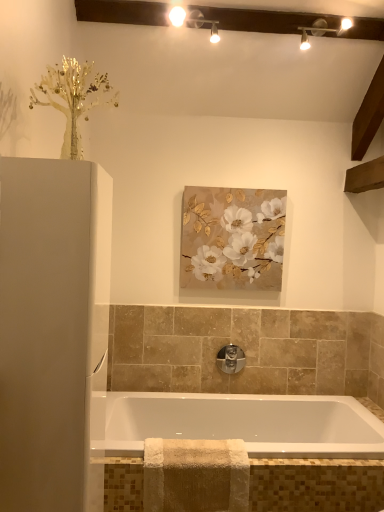
Measure the distance between point (x=279, y=258) and camera.

Point (x=279, y=258) and camera are 9.70 feet apart from each other.

Locate an element on the screen. This screenshot has width=384, height=512. white glossy cabinet at left is located at coordinates (45, 333).

The height and width of the screenshot is (512, 384). I want to click on beige textured towel at lower center, so click(x=195, y=475).

Describe the element at coordinates (177, 16) in the screenshot. I see `matte white track lights at upper center` at that location.

Locate an element on the screen. The image size is (384, 512). white glossy bathtub at center is located at coordinates coord(237,423).

The height and width of the screenshot is (512, 384). I want to click on floral arrangement lying behind the matte white track lights at upper center, so click(x=232, y=238).

Can matte gold and white floral painting at center be found inside matte white track lights at upper center?

No.

How many degrees apart are the facing directions of matte white track lights at upper center and matte gold and white floral painting at center?

The facing directions of matte white track lights at upper center and matte gold and white floral painting at center are 0.0879 degrees apart.

Consider the image. Who is taller, matte white track lights at upper center or matte gold and white floral painting at center?

Standing taller between the two is matte gold and white floral painting at center.

Do you think beige textured towel at lower center is within satin nickel faucet at center, or outside of it?

beige textured towel at lower center lies outside satin nickel faucet at center.

Is beige textured towel at lower center oriented towards satin nickel faucet at center?

No, beige textured towel at lower center is not turned towards satin nickel faucet at center.

Consider the image. Between beige textured towel at lower center and satin nickel faucet at center, which one has larger size?

With larger size is beige textured towel at lower center.

Considering the sizes of matte gold and white floral painting at center and white glossy bathtub at center in the image, is matte gold and white floral painting at center wider or thinner than white glossy bathtub at center?

Clearly, matte gold and white floral painting at center has less width compared to white glossy bathtub at center.

Does matte gold and white floral painting at center touch white glossy bathtub at center?

No, matte gold and white floral painting at center is not beside white glossy bathtub at center.

Is matte gold and white floral painting at center spatially inside white glossy bathtub at center, or outside of it?

matte gold and white floral painting at center is not inside white glossy bathtub at center, it's outside.

Could you tell me if matte gold and white floral painting at center is turned towards white glossy bathtub at center?

No, matte gold and white floral painting at center is not facing towards white glossy bathtub at center.

Which object is further away from the camera, matte white track lights at upper center or satin nickel faucet at center?

satin nickel faucet at center is behind.

Is matte white track lights at upper center far from satin nickel faucet at center?

That's right, there is a large distance between matte white track lights at upper center and satin nickel faucet at center.

Find the location of a particular element. light fixture on the left of the satin nickel faucet at center is located at coordinates (177, 16).

Considering the sizes of objects matte gold and white floral painting at center and matte white track lights at upper center in the image provided, who is taller, matte gold and white floral painting at center or matte white track lights at upper center?

matte gold and white floral painting at center.

Can you tell me how much matte gold and white floral painting at center and matte white track lights at upper center differ in facing direction?

0.0879 degrees.

Can you confirm if matte gold and white floral painting at center is smaller than matte white track lights at upper center?

Yes.

From a real-world perspective, between matte gold and white floral painting at center and matte white track lights at upper center, who is vertically higher?

From a 3D spatial view, matte white track lights at upper center is above.

Does point (231, 346) lie behind point (277, 454)?

Yes.

Between satin nickel faucet at center and white glossy bathtub at center, which one appears on the right side from the viewer's perspective?

From the viewer's perspective, white glossy bathtub at center appears more on the right side.

Looking at this image, is there a large distance between satin nickel faucet at center and white glossy bathtub at center?

No, satin nickel faucet at center is in close proximity to white glossy bathtub at center.

From the image's perspective, which object appears higher, satin nickel faucet at center or white glossy bathtub at center?

satin nickel faucet at center.

The image size is (384, 512). I want to click on bathtub above the beige textured towel at lower center (from the image's perspective), so click(237, 423).

From a real-world perspective, between white glossy bathtub at center and beige textured towel at lower center, who is vertically lower?

beige textured towel at lower center, from a real-world perspective.

Between white glossy bathtub at center and beige textured towel at lower center, which one has less height?

white glossy bathtub at center is shorter.

Identify the location of floral arrangement lying below the matte white track lights at upper center (from the image's perspective). (232, 238).

In order to click on material below the satin nickel faucet at center (from a real-world perspective) in this screenshot , I will do `click(195, 475)`.

From the image, which object appears to be nearer to white glossy bathtub at center, white glossy cabinet at left or beige textured towel at lower center?

beige textured towel at lower center is positioned closer to the anchor white glossy bathtub at center.

Estimate the real-world distances between objects in this image. Which object is further from beige textured towel at lower center, matte gold and white floral painting at center or satin nickel faucet at center?

Based on the image, matte gold and white floral painting at center appears to be further to beige textured towel at lower center.

Looking at the image, which one is located further to white glossy bathtub at center, matte gold and white floral painting at center or satin nickel faucet at center?

matte gold and white floral painting at center lies further to white glossy bathtub at center than the other object.

Which object lies further to the anchor point white glossy cabinet at left, white glossy bathtub at center or satin nickel faucet at center?

satin nickel faucet at center is further to white glossy cabinet at left.

Estimate the real-world distances between objects in this image. Which object is further from satin nickel faucet at center, white glossy bathtub at center or matte gold and white floral painting at center?

matte gold and white floral painting at center lies further to satin nickel faucet at center than the other object.

When comparing their distances from satin nickel faucet at center, does matte gold and white floral painting at center or beige textured towel at lower center seem further?

beige textured towel at lower center is positioned further to the anchor satin nickel faucet at center.

Which object lies further to the anchor point matte white track lights at upper center, white glossy cabinet at left or beige textured towel at lower center?

Based on the image, beige textured towel at lower center appears to be further to matte white track lights at upper center.

Which object lies further to the anchor point matte gold and white floral painting at center, matte white track lights at upper center or satin nickel faucet at center?

The object further to matte gold and white floral painting at center is matte white track lights at upper center.

The height and width of the screenshot is (512, 384). Find the location of `screen door that lies between matte white track lights at upper center and satin nickel faucet at center from top to bottom`. screen door that lies between matte white track lights at upper center and satin nickel faucet at center from top to bottom is located at coordinates (45, 333).

The width and height of the screenshot is (384, 512). What are the coordinates of `material between white glossy cabinet at left and white glossy bathtub at center` in the screenshot? It's located at (x=195, y=475).

What are the coordinates of `material between white glossy cabinet at left and matte gold and white floral painting at center from front to back` in the screenshot? It's located at (195, 475).

Find the location of a particular element. The width and height of the screenshot is (384, 512). floral arrangement that lies between matte white track lights at upper center and satin nickel faucet at center from top to bottom is located at coordinates 232,238.